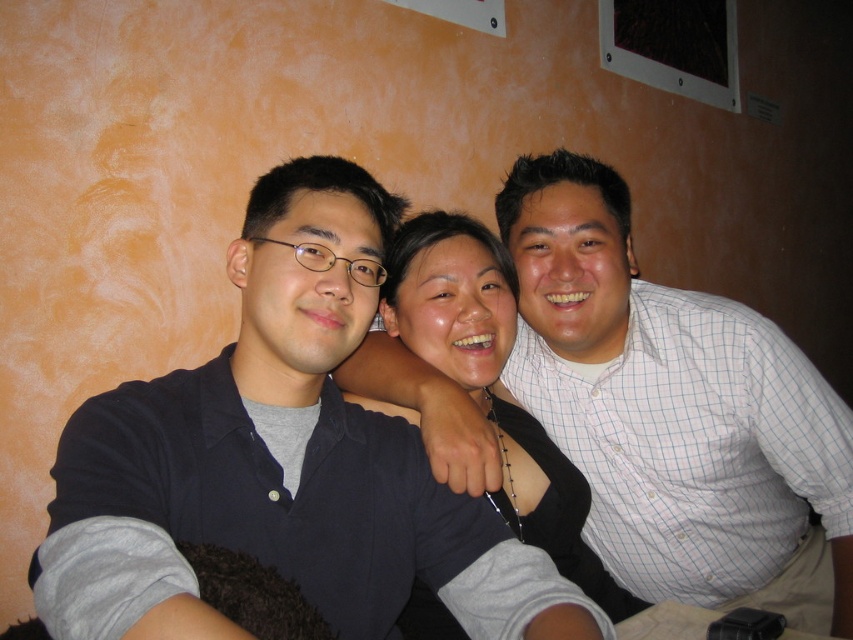
You are taking a photo of the three people in the scene. You want to focus on the point that is closer to the camera. Which point should you choose between point (308,477) and point (436,259)?

Point (308,477) is closer to the camera than point (436,259), so you should choose point (308,477) to focus on.

You are a photographer trying to focus on the dark blue shirt at center and the matte black sweater at center in the image. Which one is positioned higher in the frame?

The dark blue shirt at center is positioned higher in the frame than the matte black sweater at center.